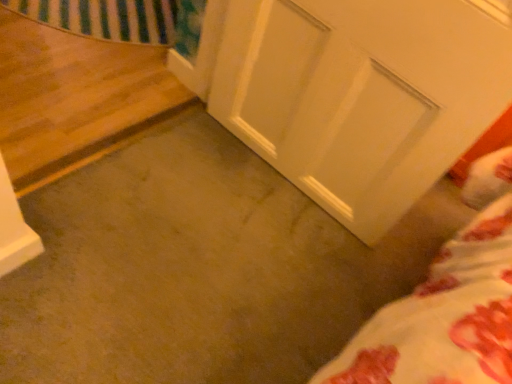
This screenshot has height=384, width=512. In order to click on carpet at center in this screenshot , I will do `click(198, 268)`.

What do you see at coordinates (198, 268) in the screenshot?
I see `carpet at center` at bounding box center [198, 268].

Measure the distance between carpet at center and camera.

They are 3.30 feet apart.

Locate an element on the screen. The width and height of the screenshot is (512, 384). carpet at center is located at coordinates (198, 268).